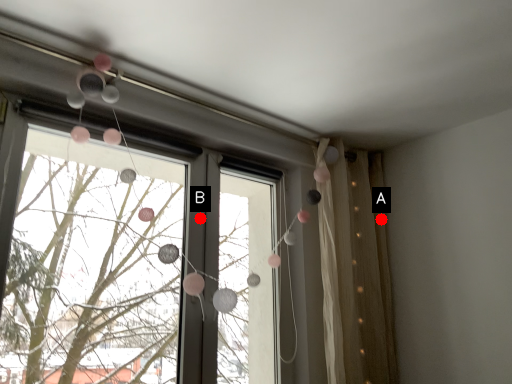
Question: Two points are circled on the image, labeled by A and B beside each circle. Which point is closer to the camera?

Choices:
 (A) A is closer
 (B) B is closer

Answer: (B)